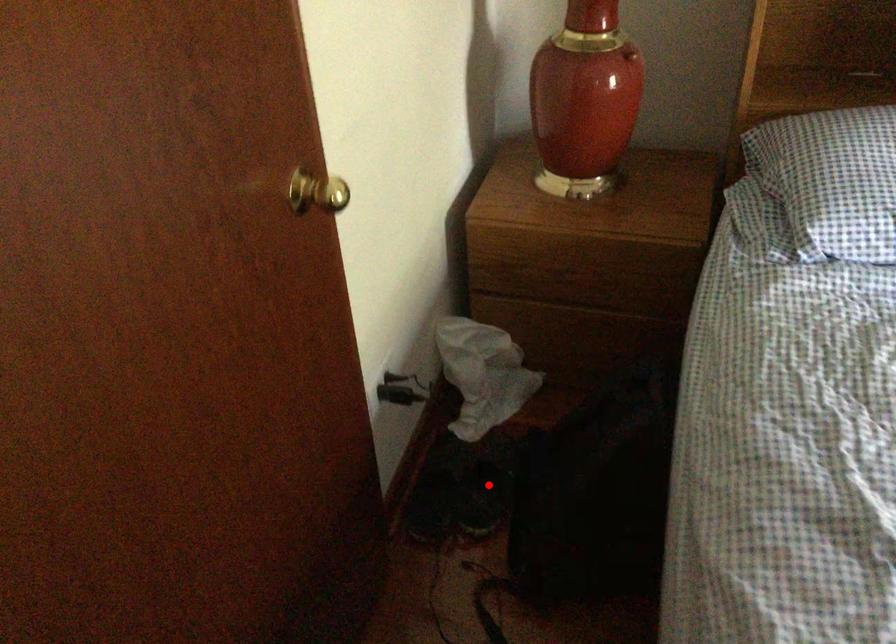
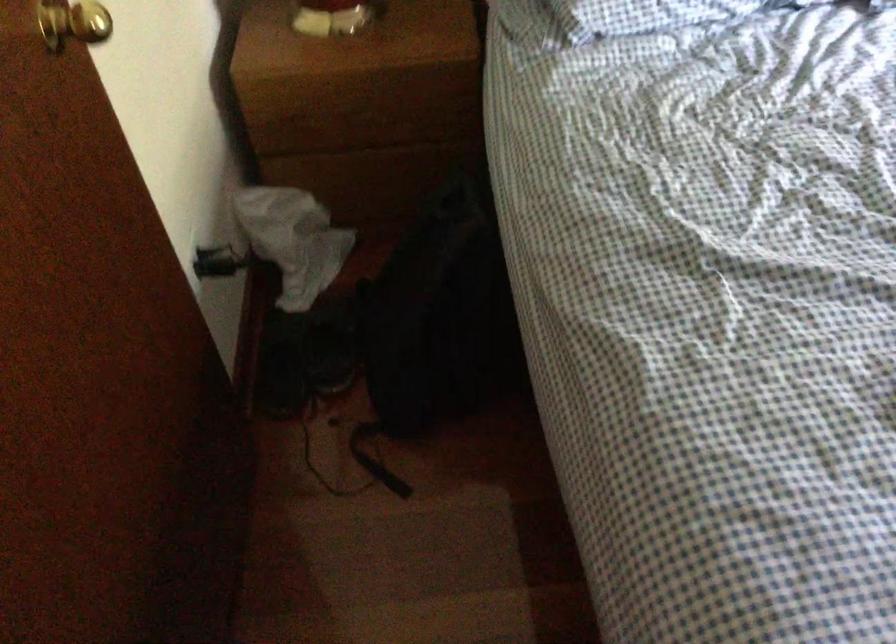
Find the pixel in the second image that matches the highlighted location in the first image.

(332, 345)